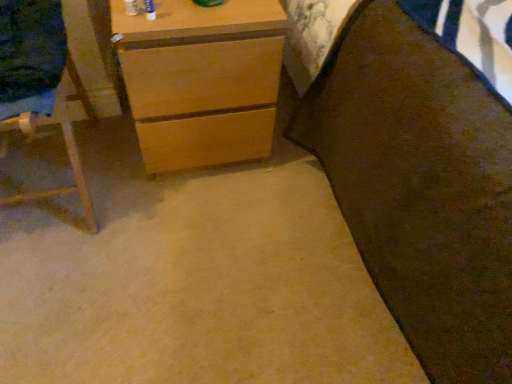
Question: Does brown fabric bed at right come in front of light brown wood chest of drawers at upper left?

Choices:
 (A) yes
 (B) no

Answer: (A)

Question: Is brown fabric bed at right not close to light brown wood chest of drawers at upper left?

Choices:
 (A) yes
 (B) no

Answer: (B)

Question: Can you confirm if brown fabric bed at right is taller than light brown wood chest of drawers at upper left?

Choices:
 (A) yes
 (B) no

Answer: (A)

Question: Considering the relative positions of brown fabric bed at right and light brown wood chest of drawers at upper left in the image provided, is brown fabric bed at right to the left of light brown wood chest of drawers at upper left from the viewer's perspective?

Choices:
 (A) no
 (B) yes

Answer: (A)

Question: Can we say brown fabric bed at right lies outside light brown wood chest of drawers at upper left?

Choices:
 (A) no
 (B) yes

Answer: (B)

Question: From a real-world perspective, is wooden easel at left above or below light brown wood chest of drawers at upper left?

Choices:
 (A) above
 (B) below

Answer: (A)

Question: From their relative heights in the image, would you say wooden easel at left is taller or shorter than light brown wood chest of drawers at upper left?

Choices:
 (A) tall
 (B) short

Answer: (A)

Question: Looking at their shapes, would you say wooden easel at left is wider or thinner than light brown wood chest of drawers at upper left?

Choices:
 (A) thin
 (B) wide

Answer: (A)

Question: Visually, is wooden easel at left positioned to the left or to the right of light brown wood chest of drawers at upper left?

Choices:
 (A) left
 (B) right

Answer: (A)

Question: Is brown fabric bed at right taller or shorter than light brown wood chest of drawers at upper left?

Choices:
 (A) short
 (B) tall

Answer: (B)

Question: Is point (389, 284) positioned closer to the camera than point (223, 119)?

Choices:
 (A) farther
 (B) closer

Answer: (B)

Question: From a real-world perspective, relative to light brown wood chest of drawers at upper left, is brown fabric bed at right vertically above or below?

Choices:
 (A) below
 (B) above

Answer: (B)

Question: Is brown fabric bed at right wider or thinner than light brown wood chest of drawers at upper left?

Choices:
 (A) thin
 (B) wide

Answer: (B)

Question: From a real-world perspective, is light brown wood chest of drawers at upper left physically located above or below wooden easel at left?

Choices:
 (A) below
 (B) above

Answer: (A)

Question: Is light brown wood chest of drawers at upper left to the left or to the right of wooden easel at left in the image?

Choices:
 (A) left
 (B) right

Answer: (B)